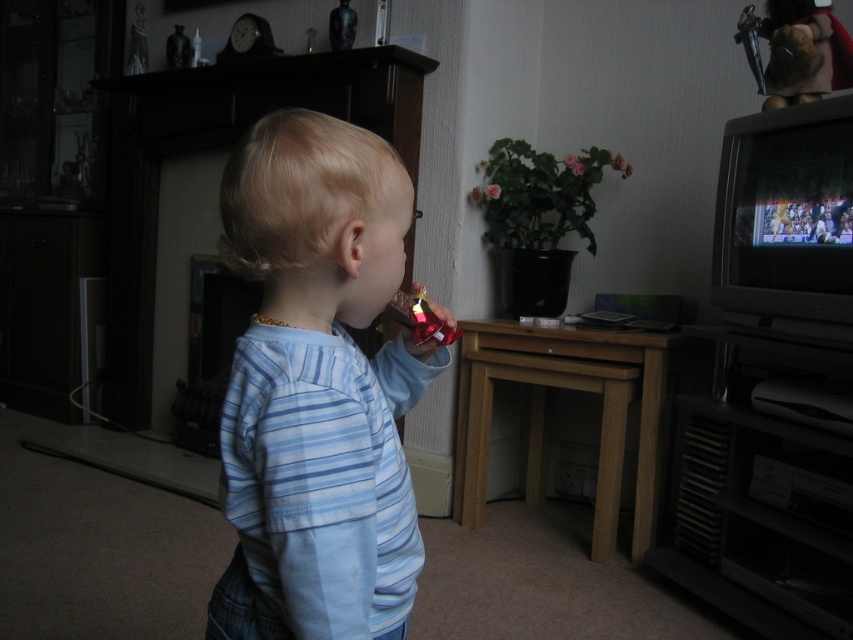
Who is more forward, (221, 488) or (751, 188)?

Point (221, 488) is more forward.

Who is higher up, blue striped shirt at center or metallic gray television at right?

Positioned higher is blue striped shirt at center.

Which is in front, point (254, 612) or point (747, 508)?

Point (254, 612) is more forward.

Image resolution: width=853 pixels, height=640 pixels. Identify the location of blue striped shirt at center. [317, 388].